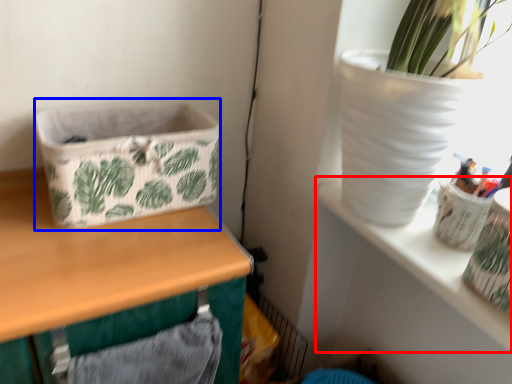
Question: Which of the following is the closest to the observer, shelf (highlighted by a red box) or basket container (highlighted by a blue box)?

Choices:
 (A) shelf
 (B) basket container

Answer: (A)